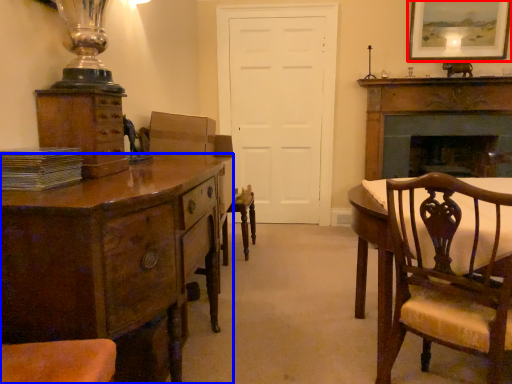
Question: Among these objects, which one is farthest to the camera, picture frame (highlighted by a red box) or chest of drawers (highlighted by a blue box)?

Choices:
 (A) picture frame
 (B) chest of drawers

Answer: (A)